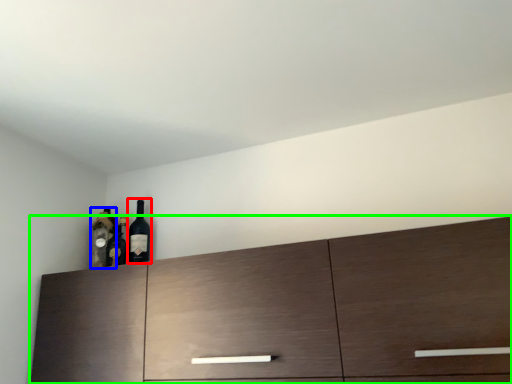
Question: Which object is positioned closest to wine bottle (highlighted by a red box)? Select from bottle (highlighted by a blue box) and cabinetry (highlighted by a green box).

Choices:
 (A) bottle
 (B) cabinetry

Answer: (A)